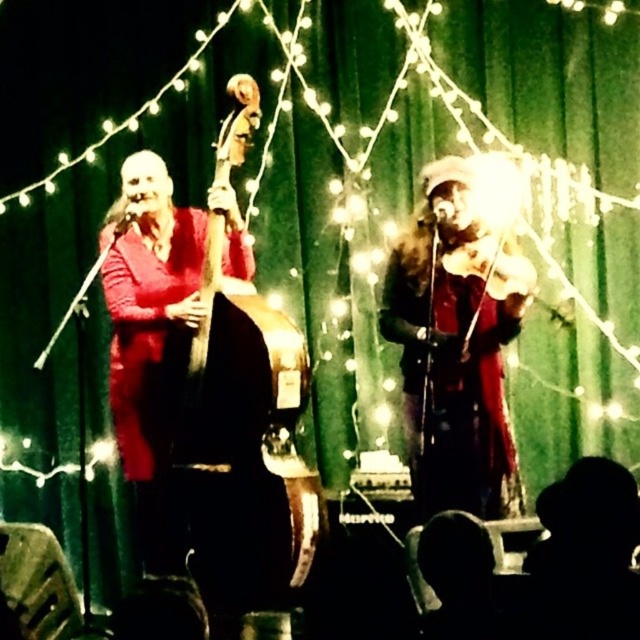
Does wooden polished cello at left have a smaller size compared to shiny red coat at center?

Correct, wooden polished cello at left occupies less space than shiny red coat at center.

Is wooden polished cello at left below shiny red coat at center?

Yes.

This screenshot has height=640, width=640. What do you see at coordinates (244, 444) in the screenshot?
I see `wooden polished cello at left` at bounding box center [244, 444].

You are a GUI agent. You are given a task and a screenshot of the screen. Output one action in this format:
    pyautogui.click(x=<x>, y=<y>)
    Task: Click on the wooden polished cello at left
    
    Given the screenshot: What is the action you would take?
    pyautogui.click(x=244, y=444)